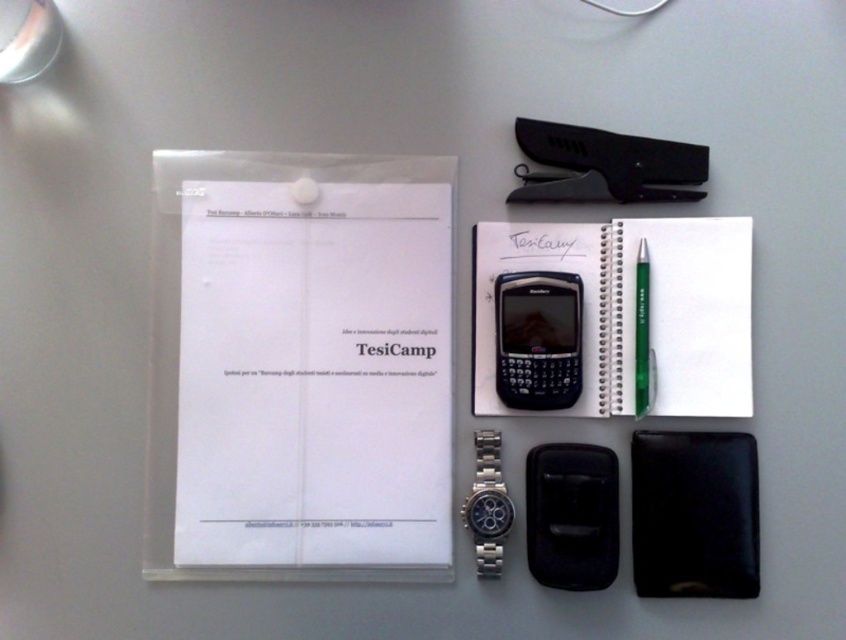
You are organizing your desk and need to place both the black leather notepad at center right and the black plastic smartphone at center into a drawer. The drawer has a width of 15 cm. Can both items fit side by side horizontally?

The black leather notepad at center right is larger in size than the black plastic smartphone at center, but without specific dimensions for each item, it is impossible to determine if they can fit side by side in a 15 cm wide drawer.